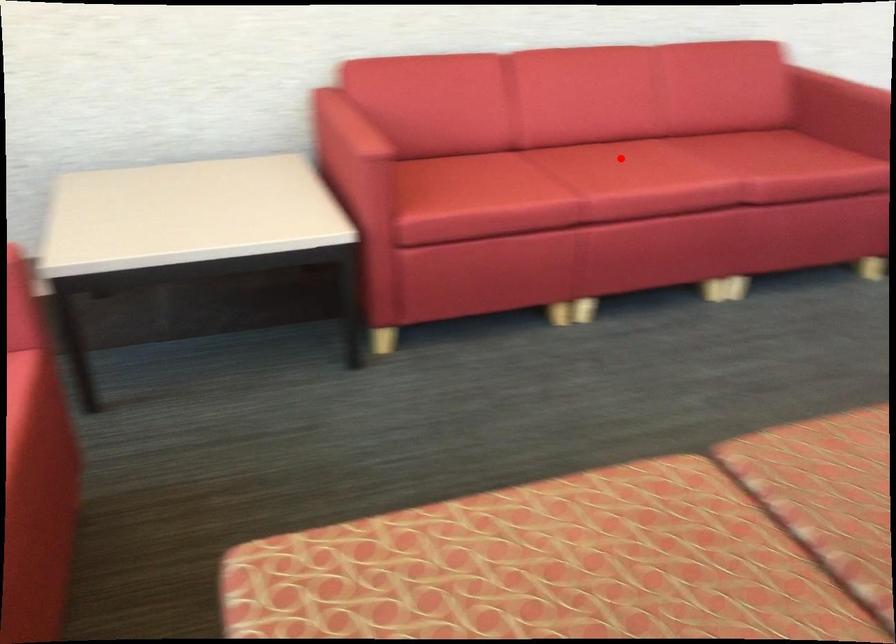
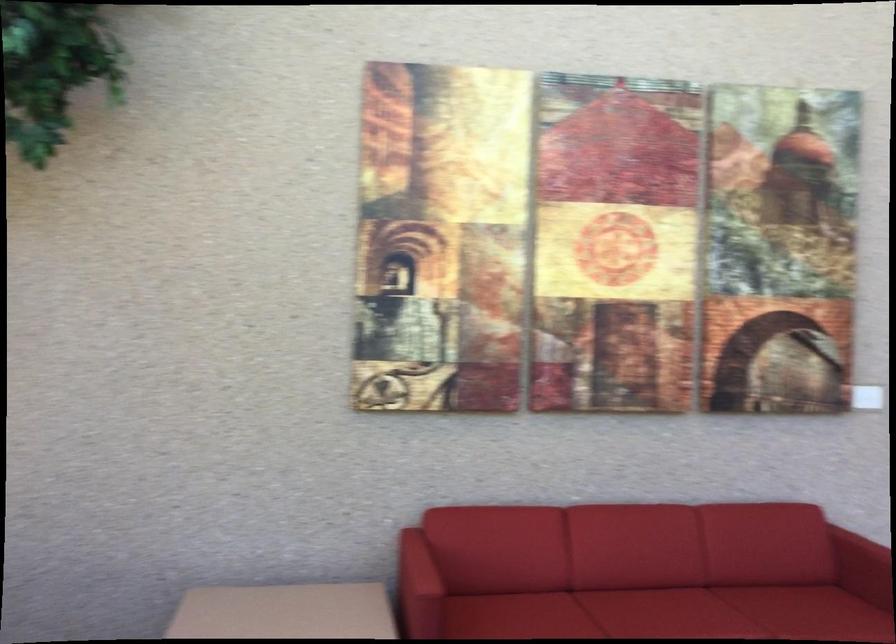
Question: I am providing you with two images of the same scene from different viewpoints. In image1, a red point is highlighted. Considering the same 3D point in image2, which of the following is correct?

Choices:
 (A) It is closer
 (B) It is farther

Answer: (B)